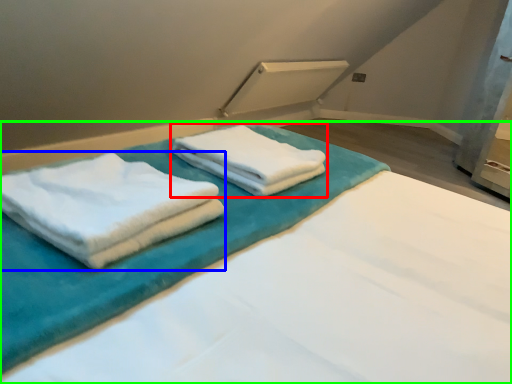
Question: Which object is positioned farthest from towel (highlighted by a red box)? Select from towel (highlighted by a blue box) and bed (highlighted by a green box).

Choices:
 (A) towel
 (B) bed

Answer: (A)